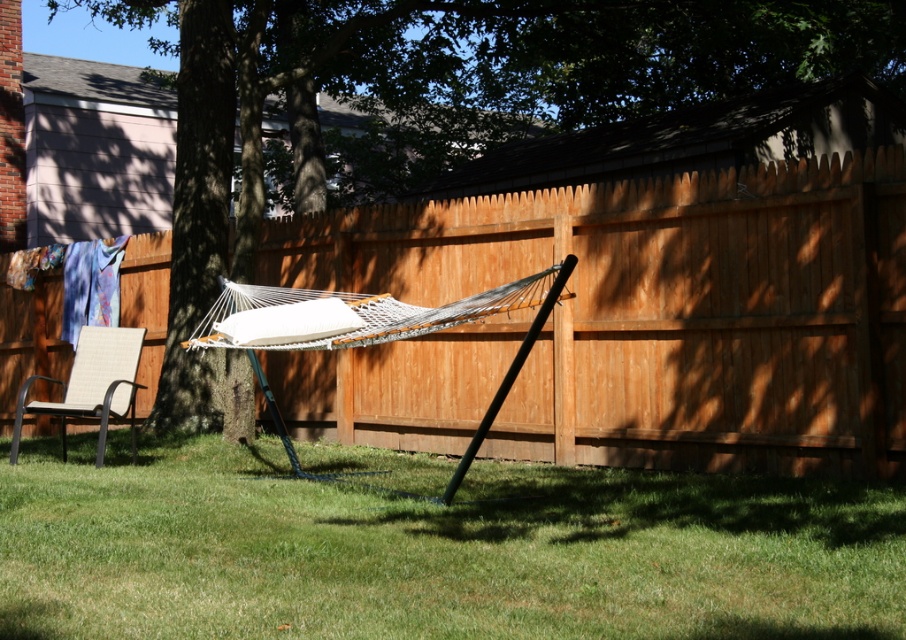
Looking at this image, you are standing in the backyard and want to place a 5 meter long garden hose from your current position to the green grass at center. Is the distance sufficient to reach?

The green grass at center is 4.32 meters from the viewer. Since the hose is 5 meters long, it can easily reach the green grass at center.

You are planning to place a new bench in the backyard such that it is between the brown wood tree at center and the beige woven chair at lower left. Based on their current positions, which object should the bench be closer to?

The bench should be placed closer to the beige woven chair at lower left because the brown wood tree at center is positioned on the right side of the beige woven chair at lower left, meaning the tree is further to the right compared to the chair.

You are planning to place a small garden statue that is 1 meter wide in the backyard. Based on the scene, which area between the green grass at center and the beige woven chair at lower left would be suitable for placing the statue without overcrowding the space?

The beige woven chair at lower left has a greater width than the green grass at center. Therefore, placing the 1 meter wide garden statue next to the beige woven chair at lower left would be more suitable as there is enough space available there.